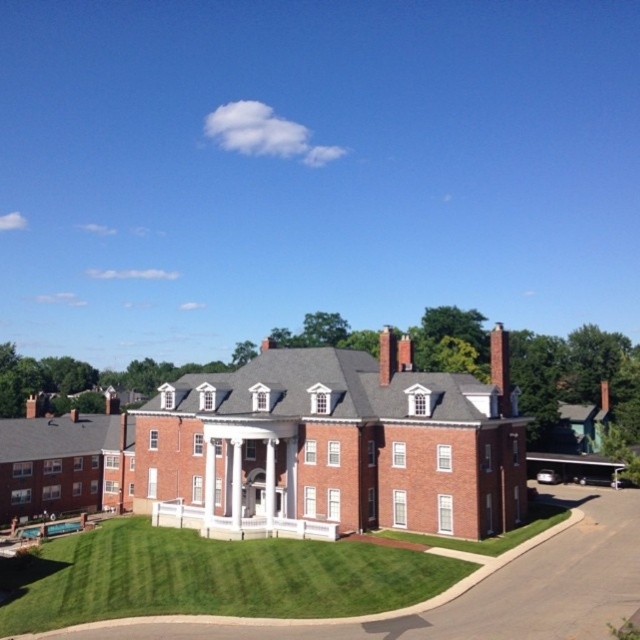
Consider the image. Does brick mansion at lower left have a lesser width compared to red brick chimney at upper center?

No, brick mansion at lower left is not thinner than red brick chimney at upper center.

Image resolution: width=640 pixels, height=640 pixels. What do you see at coordinates (54, 460) in the screenshot? I see `brick mansion at lower left` at bounding box center [54, 460].

The image size is (640, 640). I want to click on brick mansion at lower left, so click(x=54, y=460).

Does brick house at center have a lesser height compared to red brick chimney at upper center?

No, brick house at center is not shorter than red brick chimney at upper center.

Does brick house at center lie in front of red brick chimney at upper center?

Yes, brick house at center is closer to the viewer.

Does point (436, 460) come closer to viewer compared to point (508, 392)?

Yes, it is in front of point (508, 392).

Identify the location of brick house at center. This screenshot has height=640, width=640. (333, 445).

Which is in front, point (483, 556) or point (506, 348)?

Point (483, 556) is more forward.

Does green grass at lower center lie in front of red brick chimney at upper center?

That is True.

Is point (326, 624) more distant than point (493, 372)?

No, (326, 624) is in front of (493, 372).

This screenshot has height=640, width=640. I want to click on green grass at lower center, so click(339, 616).